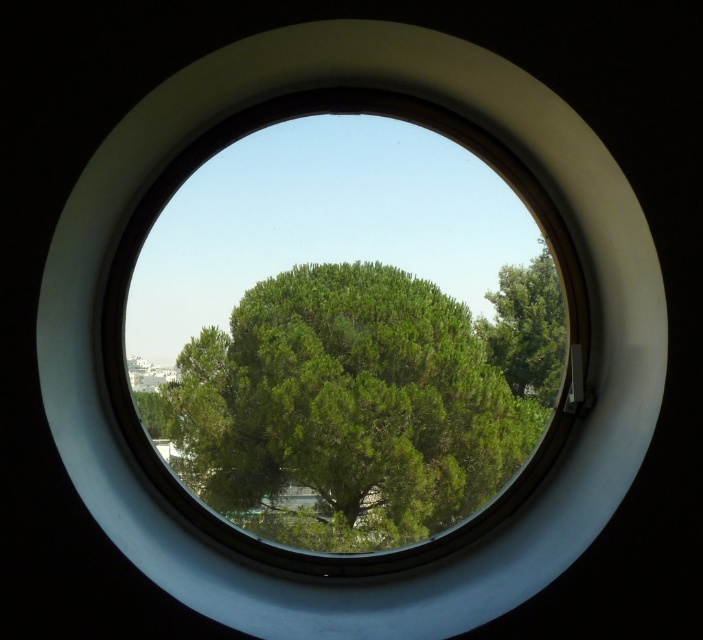
How distant is green leafy tree at center from green leafy tree at right?

They are 4.73 meters apart.

Which of these two, green leafy tree at center or green leafy tree at right, stands shorter?

green leafy tree at center

Who is more forward, (x=240, y=451) or (x=505, y=298)?

Point (x=240, y=451) is more forward.

Where is `green leafy tree at center`? Image resolution: width=703 pixels, height=640 pixels. green leafy tree at center is located at coordinates (361, 403).